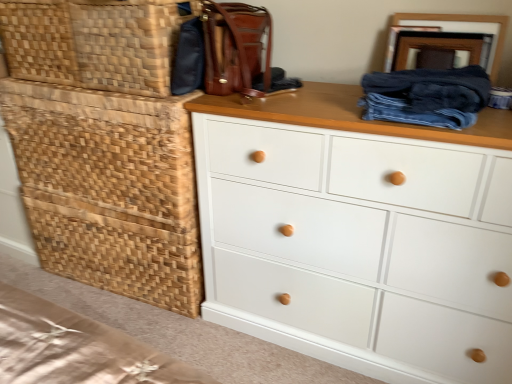
Question: From the image's perspective, is woven wood basket at left located above white painted wood chest of drawers at center?

Choices:
 (A) no
 (B) yes

Answer: (B)

Question: Is woven wood basket at left aimed at white painted wood chest of drawers at center?

Choices:
 (A) yes
 (B) no

Answer: (B)

Question: Considering the relative positions of woven wood basket at left and white painted wood chest of drawers at center in the image provided, is woven wood basket at left behind white painted wood chest of drawers at center?

Choices:
 (A) yes
 (B) no

Answer: (A)

Question: Is woven wood basket at left closer to the viewer compared to white painted wood chest of drawers at center?

Choices:
 (A) yes
 (B) no

Answer: (B)

Question: From the image's perspective, would you say woven wood basket at left is shown under white painted wood chest of drawers at center?

Choices:
 (A) yes
 (B) no

Answer: (B)

Question: Considering the positions of white painted wood chest of drawers at center and woven brown basket at upper left, the second basket positioned from the bottom, in the image, is white painted wood chest of drawers at center wider or thinner than woven brown basket at upper left, the second basket positioned from the bottom,?

Choices:
 (A) thin
 (B) wide

Answer: (B)

Question: Based on their sizes in the image, would you say white painted wood chest of drawers at center is bigger or smaller than woven brown basket at upper left, arranged as the first basket when viewed from the top?

Choices:
 (A) small
 (B) big

Answer: (B)

Question: Does point (356, 336) appear closer or farther from the camera than point (32, 72)?

Choices:
 (A) farther
 (B) closer

Answer: (B)

Question: Relative to woven brown basket at upper left, arranged as the first basket when viewed from the top, is white painted wood chest of drawers at center in front or behind?

Choices:
 (A) front
 (B) behind

Answer: (A)

Question: Is point (501, 190) positioned closer to the camera than point (236, 6)?

Choices:
 (A) closer
 (B) farther

Answer: (A)

Question: From the image's perspective, is white painted wood chest of drawers at center positioned above or below leather handbag at upper center?

Choices:
 (A) below
 (B) above

Answer: (A)

Question: Visually, is white painted wood chest of drawers at center positioned to the left or to the right of leather handbag at upper center?

Choices:
 (A) left
 (B) right

Answer: (B)

Question: Is white painted wood chest of drawers at center in front of or behind leather handbag at upper center in the image?

Choices:
 (A) front
 (B) behind

Answer: (A)

Question: Is point (486, 208) positioned closer to the camera than point (390, 110)?

Choices:
 (A) closer
 (B) farther

Answer: (A)

Question: In terms of size, does white painted wood chest of drawers at center appear bigger or smaller than dark blue denim jeans at upper right?

Choices:
 (A) small
 (B) big

Answer: (B)